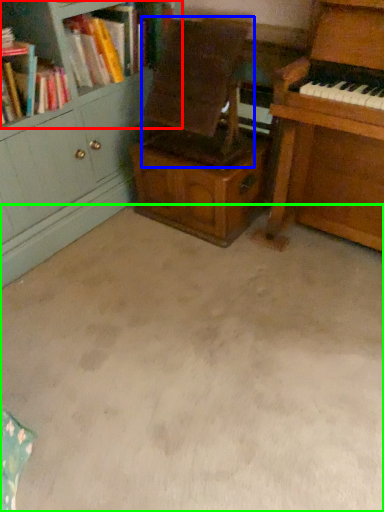
Question: Estimate the real-world distances between objects in this image. Which object is closer to bookcase (highlighted by a red box), armchair (highlighted by a blue box) or plain (highlighted by a green box)?

Choices:
 (A) armchair
 (B) plain

Answer: (A)